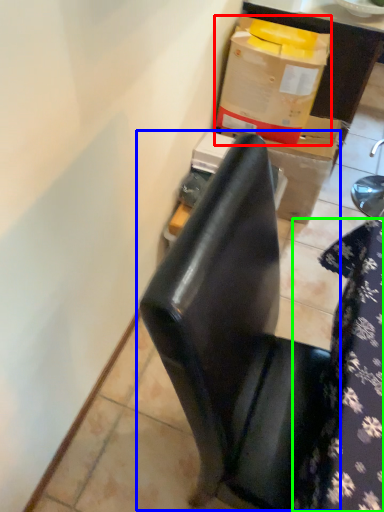
Question: Estimate the real-world distances between objects in this image. Which object is closer to box (highlighted by a red box), chair (highlighted by a blue box) or tablecloth (highlighted by a green box)?

Choices:
 (A) chair
 (B) tablecloth

Answer: (B)